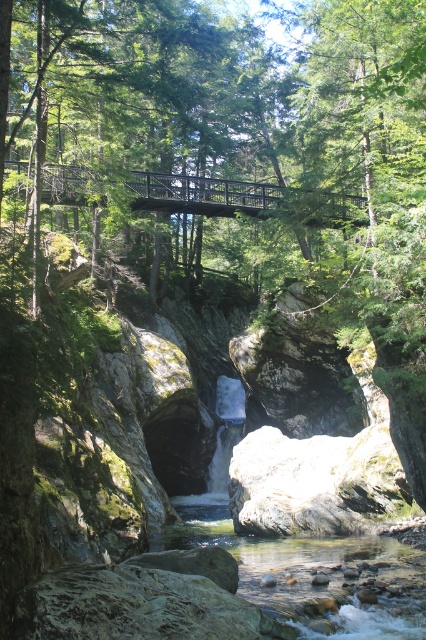
You are standing on the suspension bridge in the forest scene and notice a point marked at coordinates (310, 573). What object is located at that point?

The clear smooth rock at center is located at the coordinates point (310, 573).